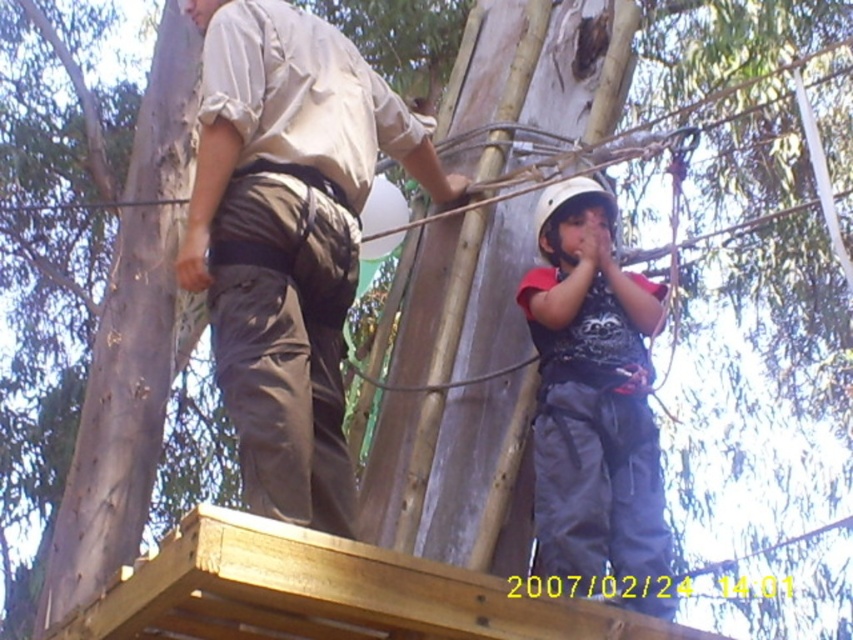
You are a safety inspector checking the setup of the ropes course. You notice two participants wearing khaki cotton pants at upper center and dark gray fabric pants at center. Based on their height difference, which participant might require a longer harness strap?

The khaki cotton pants at upper center has a greater height compared to dark gray fabric pants at center, so the participant wearing khaki cotton pants at upper center would likely need a longer harness strap to accommodate their height.

You are trying to decide which pair of pants will allow for more movement while climbing the wooden platform. Based on the image, which of the following has more flexibility? The khaki cotton pants at upper center or the dark gray fabric pants at center?

The khaki cotton pants at upper center are wider than the dark gray fabric pants at center, so they might allow for more flexibility and movement while climbing the wooden platform.